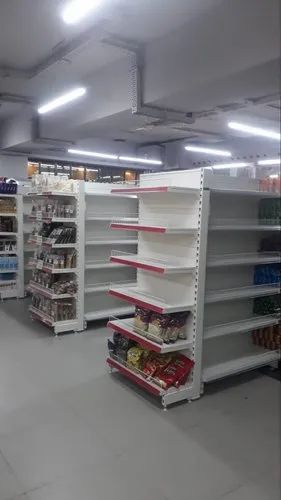
In order to click on empty shelves in this screenshot , I will do `click(97, 313)`, `click(96, 285)`, `click(96, 261)`, `click(95, 239)`, `click(95, 216)`, `click(95, 191)`.